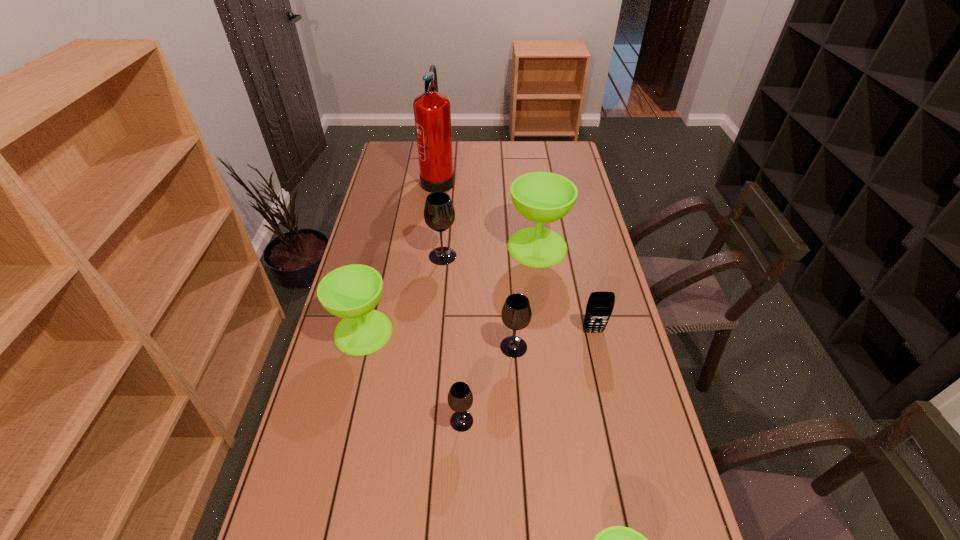
The height and width of the screenshot is (540, 960). Find the location of `the nearest gray wineglass`. the nearest gray wineglass is located at coordinates (460, 398).

You are a GUI agent. You are given a task and a screenshot of the screen. Output one action in this format:
    pyautogui.click(x=<x>, y=<y>)
    Task: Click on the fifth farthest wineglass
    This screenshot has width=960, height=540.
    Given the screenshot: What is the action you would take?
    pyautogui.click(x=460, y=398)

Identify the location of free space located on the left of the red fire extinguisher. (404, 178).

Find the location of a particular element. This screenshot has width=960, height=540. free space located on the front of the fifth wineglass from right to left is located at coordinates (438, 315).

You are a GUI agent. You are given a task and a screenshot of the screen. Output one action in this format:
    pyautogui.click(x=<x>, y=<y>)
    Task: Click on the blank area located 0.360m on the left of the farthest green wineglass
    Image resolution: width=960 pixels, height=540 pixels.
    Given the screenshot: What is the action you would take?
    pyautogui.click(x=412, y=247)

Image resolution: width=960 pixels, height=540 pixels. I want to click on vacant region located on the back of the second smallest gray wineglass, so click(509, 267).

Locate an element on the screen. The height and width of the screenshot is (540, 960). free spot located on the right of the second smallest green wineglass is located at coordinates (504, 332).

I want to click on vacant space located on the screen of the cellular telephone, so click(615, 427).

The image size is (960, 540). What are the coordinates of `free space located 0.190m on the front of the nearest gray wineglass` in the screenshot? It's located at (459, 511).

Locate an element on the screen. This screenshot has width=960, height=540. object that is positioned at the far edge is located at coordinates (432, 114).